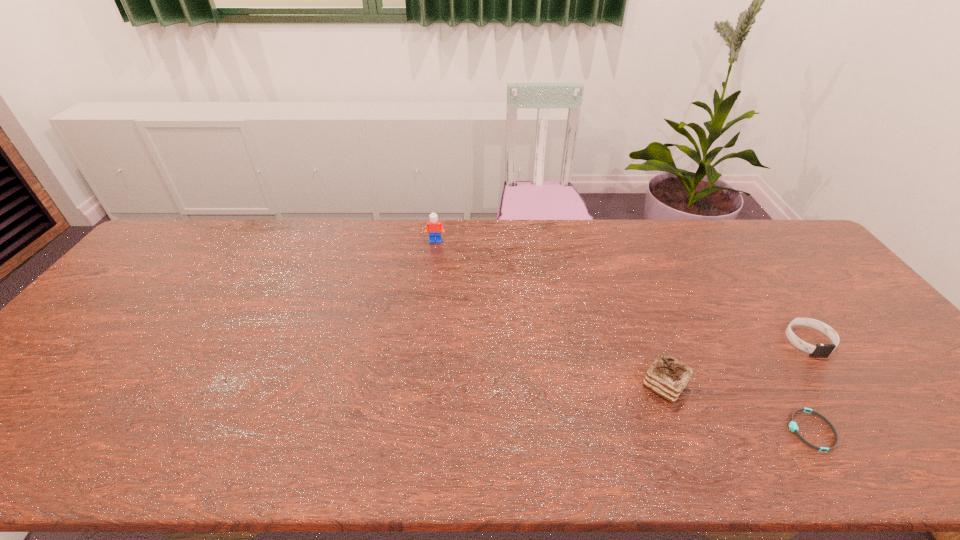
You are a GUI agent. You are given a task and a screenshot of the screen. Output one action in this format:
    pyautogui.click(x=<x>, y=<y>)
    Task: Click on the vacant area between the right wristband and the Lego
    The height and width of the screenshot is (540, 960).
    Given the screenshot: What is the action you would take?
    pyautogui.click(x=622, y=291)

You are a GUI agent. You are given a task and a screenshot of the screen. Output one action in this format:
    pyautogui.click(x=<x>, y=<y>)
    Task: Click on the free space between the shortest object and the right wristband
    The height and width of the screenshot is (540, 960).
    Given the screenshot: What is the action you would take?
    pyautogui.click(x=809, y=386)

Find the location of `the closest object relative to the rightmost object`. the closest object relative to the rightmost object is located at coordinates (793, 426).

Image resolution: width=960 pixels, height=540 pixels. I want to click on object that is the closest to the farthest object, so click(x=667, y=377).

The width and height of the screenshot is (960, 540). In order to click on vacant point that satisfies the following two spatial constraints: 1. on the outer surface of the taller wristband; 2. on the buckle of the second object from right to left in this screenshot , I will do `click(874, 430)`.

Identify the location of vacant region that satisfies the following two spatial constraints: 1. on the outer surface of the rightmost object; 2. on the buckle of the nearest object. (874, 430).

Locate an element on the screen. The width and height of the screenshot is (960, 540). vacant space that satisfies the following two spatial constraints: 1. on the face of the third shortest object; 2. on the right side of the Lego is located at coordinates (418, 385).

Identify the location of vacant space that satisfies the following two spatial constraints: 1. on the face of the leftmost object; 2. on the right side of the second tallest object. (418, 385).